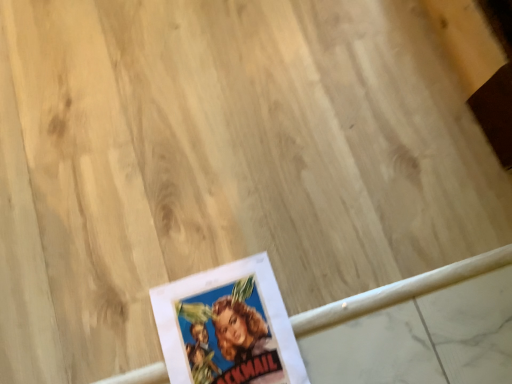
Where is `unoccupied area behind matte paper picture frame at lower center`? unoccupied area behind matte paper picture frame at lower center is located at coordinates (250, 220).